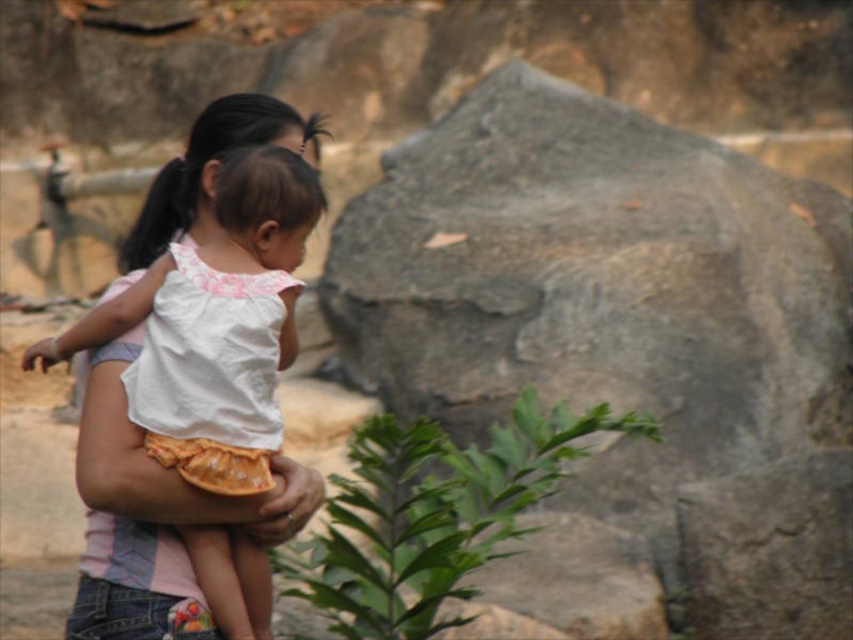
Between gray rough stone at center and white cotton shirt at center, which one has more height?

→ With more height is gray rough stone at center.

Based on the photo, does gray rough stone at center have a lesser height compared to white cotton shirt at center?

No, gray rough stone at center is not shorter than white cotton shirt at center.

Is point (693, 403) in front of point (138, 477)?

No, it is behind (138, 477).

Find the location of a particular element. This screenshot has height=640, width=853. gray rough stone at center is located at coordinates (619, 323).

Between gray rough stone at center and green leafy plant at center, which one appears on the right side from the viewer's perspective?

Positioned to the right is gray rough stone at center.

Which of these two, gray rough stone at center or green leafy plant at center, stands taller?

Standing taller between the two is gray rough stone at center.

In order to click on gray rough stone at center in this screenshot , I will do `click(619, 323)`.

Which is more to the left, white cotton shirt at center or black silky hair at center?

Positioned to the left is black silky hair at center.

Is white cotton shirt at center positioned in front of black silky hair at center?

That is True.

Is point (204, 173) positioned after point (183, 189)?

No, (204, 173) is in front of (183, 189).

I want to click on white cotton shirt at center, so click(x=134, y=461).